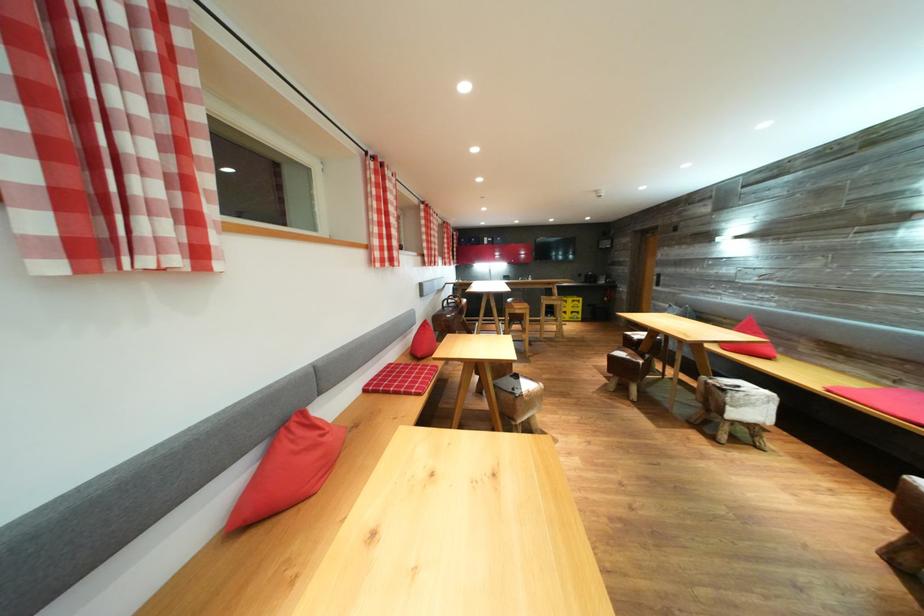
Find where to sit the stool sitting surface. Please return your answer as a coordinate pair (x, y).

(735, 408)